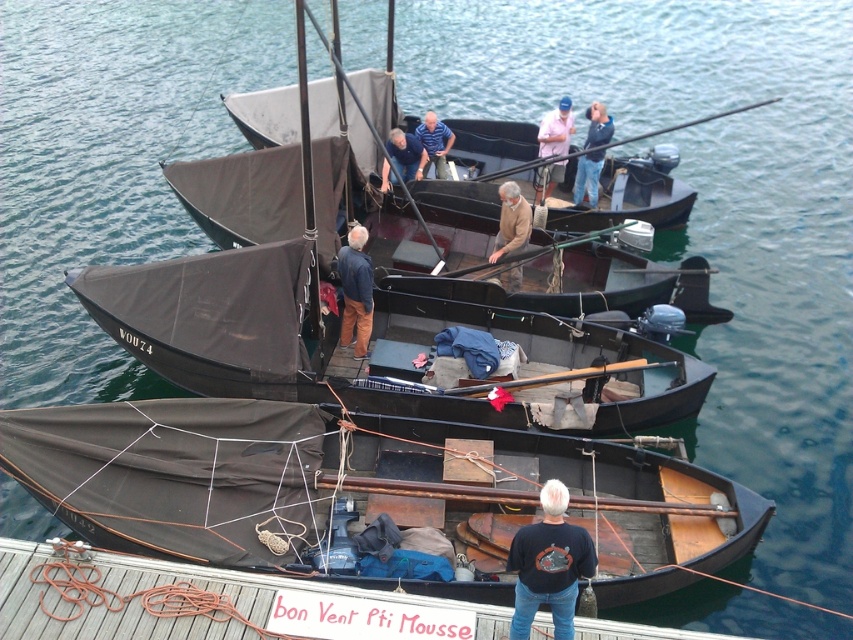
Question: Does matte black sailboat at center appear under light brown wooden boat at center?

Choices:
 (A) yes
 (B) no

Answer: (A)

Question: Which object appears farthest from the camera in this image?

Choices:
 (A) dark brown canvas boat at lower center
 (B) light brown wooden boat at center
 (C) dark brown canvas boat at center
 (D) dark brown fabric sail at center

Answer: (D)

Question: Can you confirm if black cotton shirt at lower center is thinner than dark brown fabric sail at center?

Choices:
 (A) yes
 (B) no

Answer: (A)

Question: Estimate the real-world distances between objects in this image. Which object is closer to the blue striped shirt at center?

Choices:
 (A) pink fabric at center
 (B) wooden dock at lower left
 (C) black cotton shirt at lower center
 (D) blue denim jacket at center

Answer: (A)

Question: Which point is farther to the camera?

Choices:
 (A) (546, 563)
 (B) (10, 579)
 (C) (659, 182)
 (D) (596, 122)

Answer: (C)

Question: Is matte black sailboat at center below blue denim jacket at center?

Choices:
 (A) yes
 (B) no

Answer: (A)